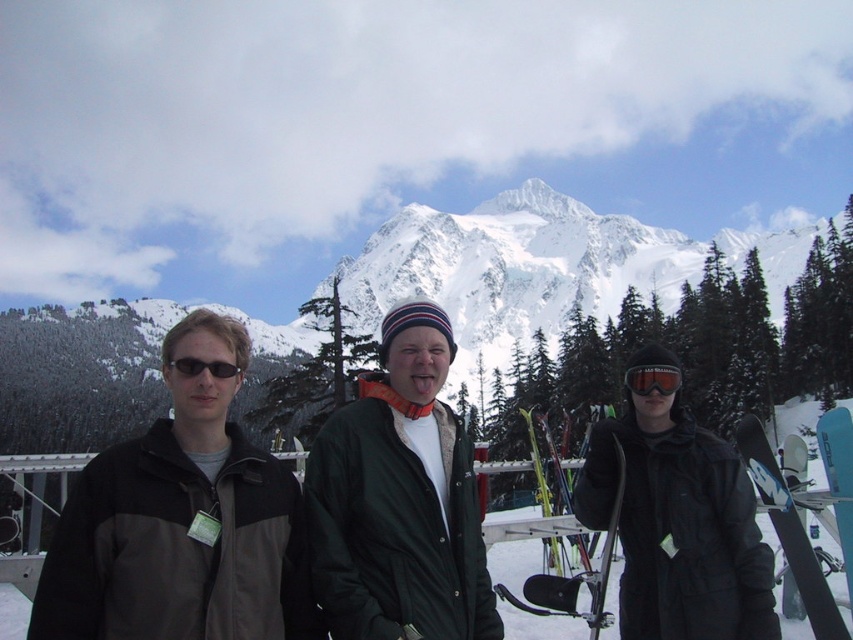
The image size is (853, 640). Describe the element at coordinates (576, 573) in the screenshot. I see `yellow metallic ski at center` at that location.

Can you confirm if yellow metallic ski at center is wider than black matte sunglasses at center?

Indeed, yellow metallic ski at center has a greater width compared to black matte sunglasses at center.

I want to click on yellow metallic ski at center, so click(x=576, y=573).

Where is `yellow metallic ski at center`? This screenshot has width=853, height=640. yellow metallic ski at center is located at coordinates (576, 573).

Is point (641, 561) positioned in front of point (183, 376)?

No.

Who is more forward, (631, 356) or (178, 371)?

Positioned in front is point (178, 371).

Where is `black matte jacket at center`? The image size is (853, 640). black matte jacket at center is located at coordinates (677, 525).

Between black matte jacket at center and black matte goggles at center, which one is positioned higher?

black matte goggles at center

Does black matte jacket at center have a larger size compared to black matte goggles at center?

Yes.

Looking at this image, who is more forward, (x=767, y=557) or (x=660, y=380)?

Point (x=767, y=557) is more forward.

The width and height of the screenshot is (853, 640). Identify the location of black matte jacket at center. (677, 525).